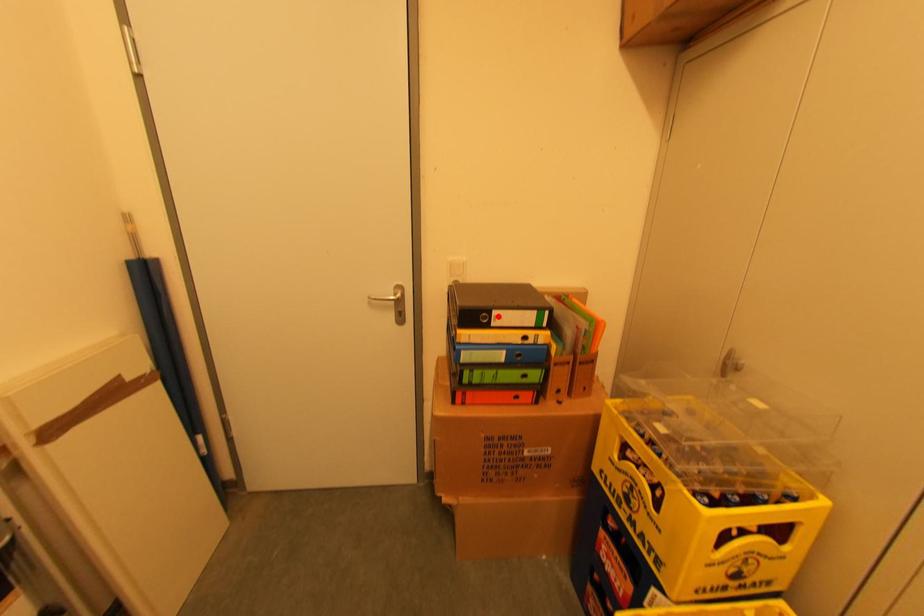
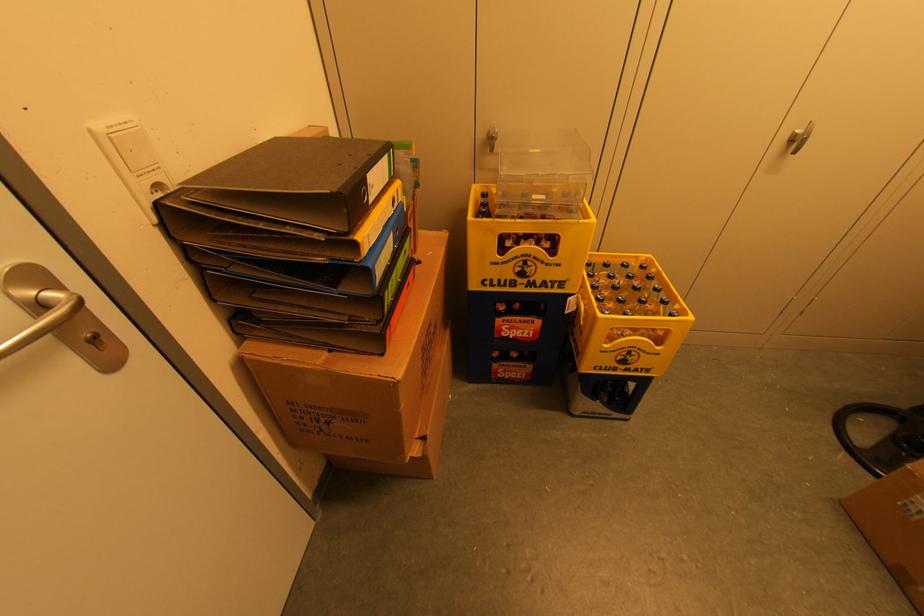
The point at the highlighted location is marked in the first image. Where is the corresponding point in the second image?

(371, 185)